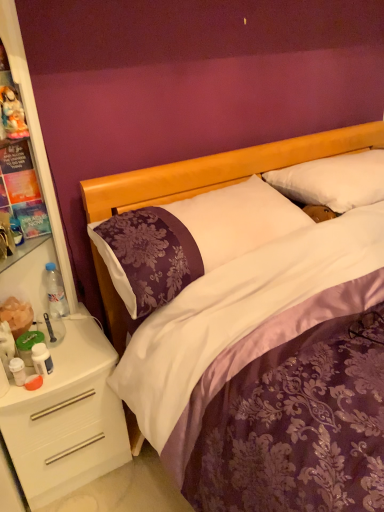
This screenshot has width=384, height=512. What are the coordinates of `vacant space in front of clear plastic bottle at left` in the screenshot? It's located at (70, 340).